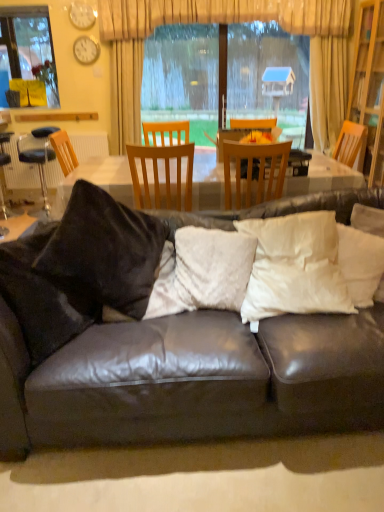
Question: From a real-world perspective, is beige fabric curtain at upper center physically above black leather bar stool at left?

Choices:
 (A) no
 (B) yes

Answer: (B)

Question: Is beige fabric curtain at upper center directly adjacent to black leather bar stool at left?

Choices:
 (A) yes
 (B) no

Answer: (B)

Question: Is beige fabric curtain at upper center bigger than black leather bar stool at left?

Choices:
 (A) yes
 (B) no

Answer: (A)

Question: Does beige fabric curtain at upper center have a greater width compared to black leather bar stool at left?

Choices:
 (A) yes
 (B) no

Answer: (A)

Question: Can you confirm if beige fabric curtain at upper center is smaller than black leather bar stool at left?

Choices:
 (A) yes
 (B) no

Answer: (B)

Question: Would you say leather couch with pillows at center is inside or outside matte white clock at upper left, arranged as the 2th clock when ordered from the bottom?

Choices:
 (A) inside
 (B) outside

Answer: (B)

Question: Considering their positions, is leather couch with pillows at center located in front of or behind matte white clock at upper left, arranged as the 2th clock when ordered from the bottom?

Choices:
 (A) behind
 (B) front

Answer: (B)

Question: Considering the positions of leather couch with pillows at center and matte white clock at upper left, the 1th clock from the top, in the image, is leather couch with pillows at center wider or thinner than matte white clock at upper left, the 1th clock from the top,?

Choices:
 (A) wide
 (B) thin

Answer: (A)

Question: In terms of size, does leather couch with pillows at center appear bigger or smaller than matte white clock at upper left, arranged as the 2th clock when ordered from the bottom?

Choices:
 (A) big
 (B) small

Answer: (A)

Question: Based on their sizes in the image, would you say white soft pillow at center, positioned as the second pillow in left-to-right order, is bigger or smaller than beige fabric curtain at upper center?

Choices:
 (A) big
 (B) small

Answer: (B)

Question: Considering their positions, is white soft pillow at center, positioned as the second pillow in left-to-right order, located in front of or behind beige fabric curtain at upper center?

Choices:
 (A) behind
 (B) front

Answer: (B)

Question: Is white soft pillow at center, the second pillow viewed from the right, inside the boundaries of beige fabric curtain at upper center, or outside?

Choices:
 (A) inside
 (B) outside

Answer: (B)

Question: Is point (309, 276) positioned closer to the camera than point (190, 17)?

Choices:
 (A) closer
 (B) farther

Answer: (A)

Question: Would you say white soft pillow at right, which ranks as the 1th pillow in right-to-left order, is to the left or to the right of matte white clock at upper left, arranged as the 2th clock when ordered from the bottom, in the picture?

Choices:
 (A) right
 (B) left

Answer: (A)

Question: Is white soft pillow at right, which ranks as the 1th pillow in right-to-left order, taller or shorter than matte white clock at upper left, the 1th clock from the top?

Choices:
 (A) short
 (B) tall

Answer: (B)